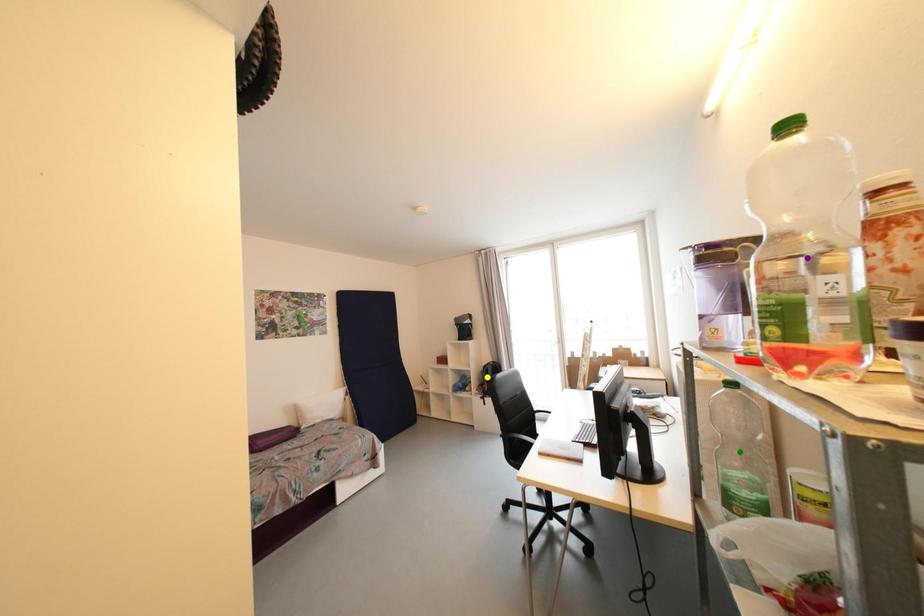
Order these from nearest to farthest:
1. purple point
2. green point
3. yellow point

1. yellow point
2. green point
3. purple point